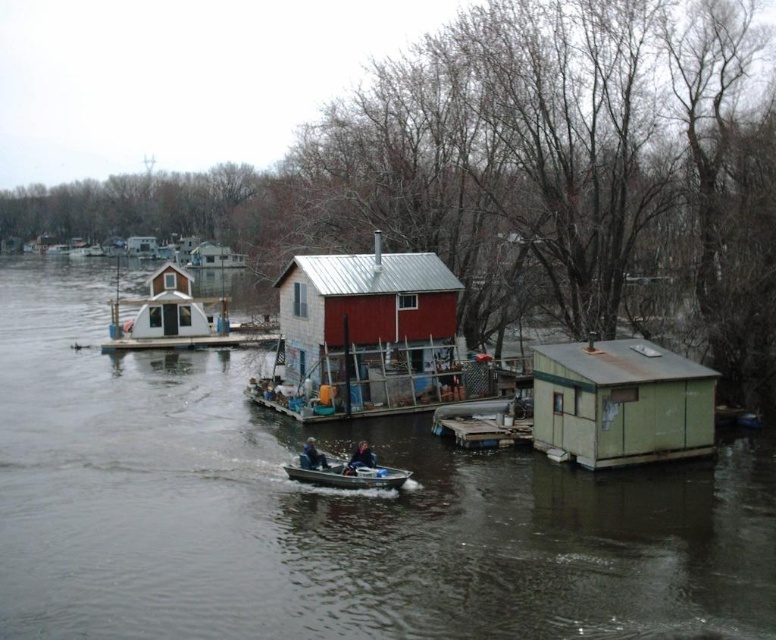
Is point (629, 456) in front of point (352, 461)?

No.

Does green weathered cabin at right appear on the right side of dark blue fabric jacket at center?

Yes, green weathered cabin at right is to the right of dark blue fabric jacket at center.

Image resolution: width=776 pixels, height=640 pixels. What do you see at coordinates (622, 403) in the screenshot? I see `green weathered cabin at right` at bounding box center [622, 403].

Identify the location of green weathered cabin at right. (622, 403).

Does point (338, 467) lie behind point (362, 454)?

Yes, it is.

Which is more to the left, metallic gray boat at center or dark blue fabric jacket at center?

From the viewer's perspective, metallic gray boat at center appears more on the left side.

Does point (298, 461) come farther from viewer compared to point (348, 472)?

Yes, it is.

You are a GUI agent. You are given a task and a screenshot of the screen. Output one action in this format:
    pyautogui.click(x=<x>, y=<y>)
    Task: Click on the metallic gray boat at center
    This screenshot has width=776, height=640.
    Given the screenshot: What is the action you would take?
    pyautogui.click(x=345, y=468)

Does red corrugated metal hut at center appear on the left side of dark blue fabric jacket at center?

Indeed, red corrugated metal hut at center is positioned on the left side of dark blue fabric jacket at center.

Is red corrugated metal hut at center below dark blue fabric jacket at center?

No, red corrugated metal hut at center is not below dark blue fabric jacket at center.

Describe the element at coordinates (365, 310) in the screenshot. I see `red corrugated metal hut at center` at that location.

Locate an element on the screen. red corrugated metal hut at center is located at coordinates (365, 310).